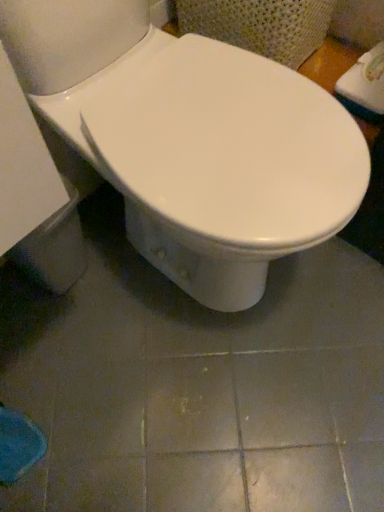
At what (x,y) coordinates should I click in order to perform the action: click on unoccupied area in front of white glossy bidet at center. Please return your answer as a coordinate pair (x, y). Looking at the image, I should click on (192, 409).